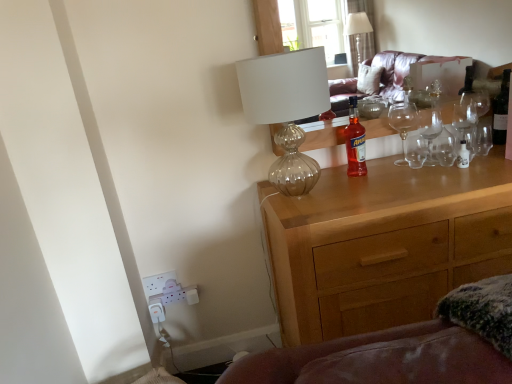
This screenshot has width=512, height=384. In order to click on vacant space to the right of translucent glass lamp at upper center in this screenshot , I will do `click(376, 189)`.